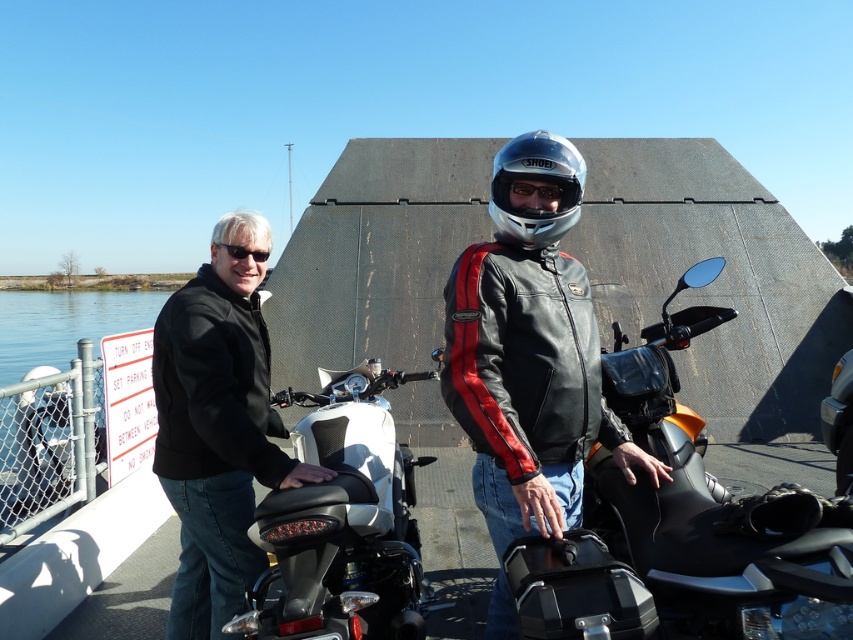
You are standing on the ferry and want to place a small box between the two points labeled point (225, 563) and point (244, 248). Which point should the box be closer to if you want it to appear closer to you?

The box should be placed closer to point (225, 563) because it is already closer to the viewer than point (244, 248).

You are a photographer trying to capture both the silver metallic helmet at center and the black plastic goggles at upper left in the same frame. Based on their positions, which object should you adjust your camera to focus on first to ensure both are in the shot?

The silver metallic helmet at center is positioned on the right side of black plastic goggles at upper left. To capture both in the same frame, focus on the black plastic goggles at upper left first since it is on the left, allowing the helmet to naturally fall into the right side of the frame.